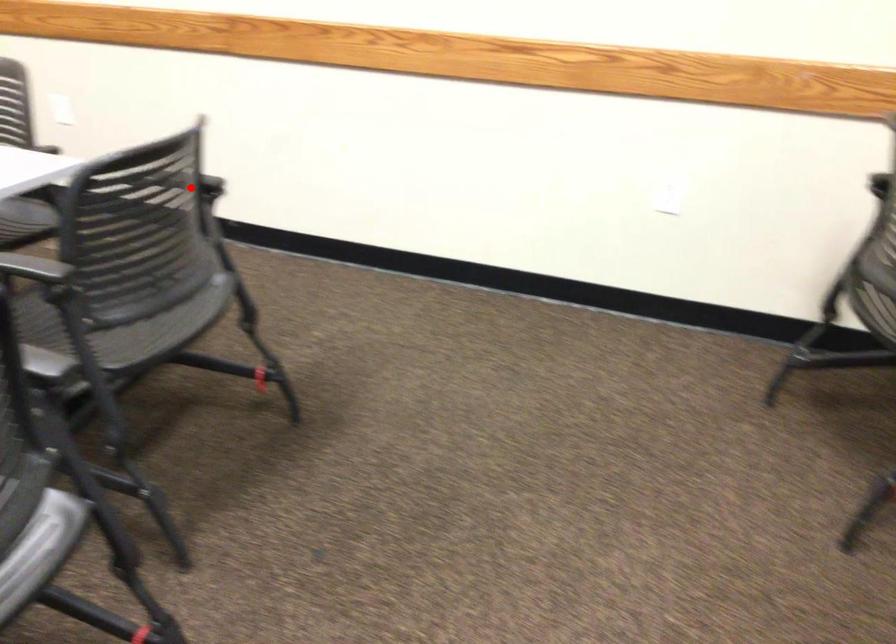
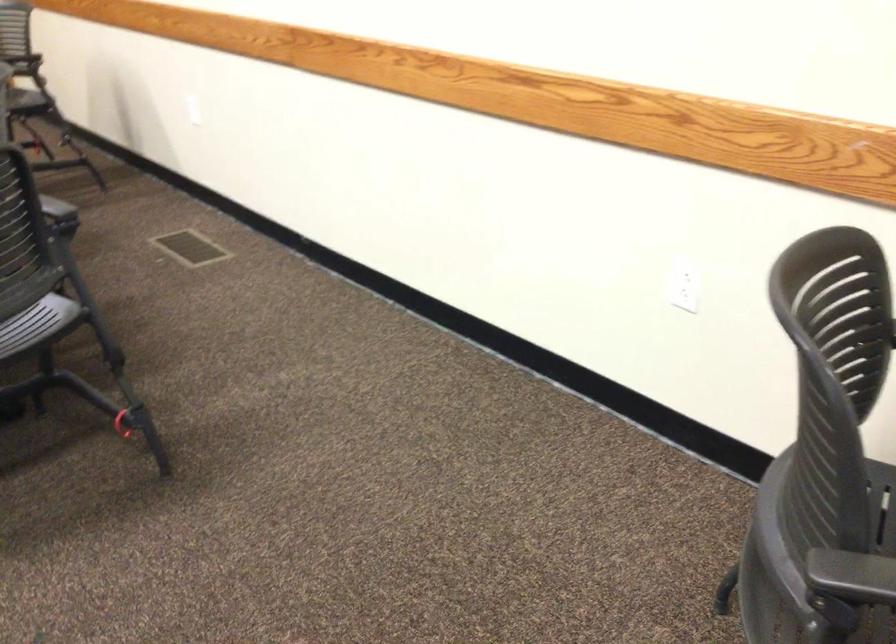
Where in the second image is the point corresponding to the highlighted location from the first image?

(56, 207)